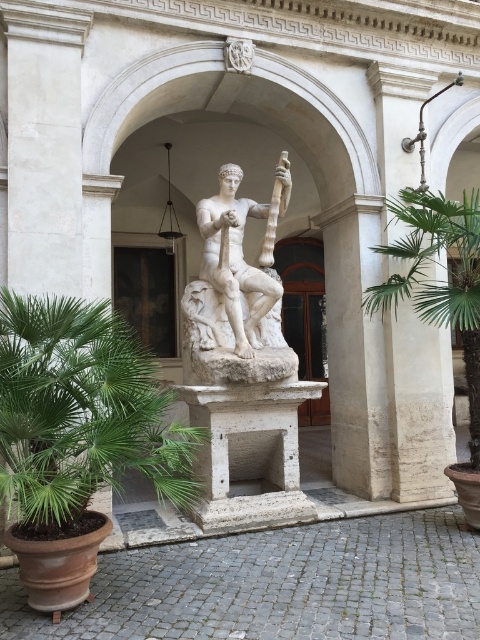
Question: Among these points, which one is nearest to the camera?

Choices:
 (A) (455, 209)
 (B) (280, 209)

Answer: (A)

Question: Which of the following is the closest to the observer?

Choices:
 (A) (446, 280)
 (B) (248, 198)

Answer: (A)

Question: Is white marble statue at center smaller than green leafy palm at right?

Choices:
 (A) no
 (B) yes

Answer: (B)

Question: Can you confirm if white marble statue at center is positioned to the left of green leafy palm at right?

Choices:
 (A) yes
 (B) no

Answer: (A)

Question: Is the position of white marble statue at center more distant than that of green leafy palm at right?

Choices:
 (A) no
 (B) yes

Answer: (B)

Question: Which point is farther to the camera?

Choices:
 (A) green leafy palm at right
 (B) white marble statue at center

Answer: (B)